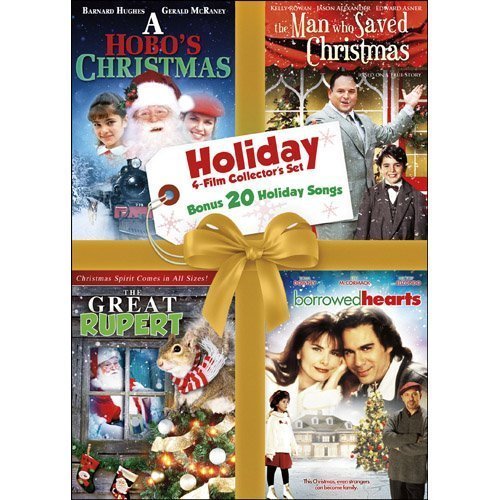
Find the location of a particular element. The image size is (500, 500). christmas decorations is located at coordinates (85, 468), (125, 483), (155, 478), (164, 421), (188, 481), (214, 447), (379, 433), (288, 97), (413, 137), (136, 95).